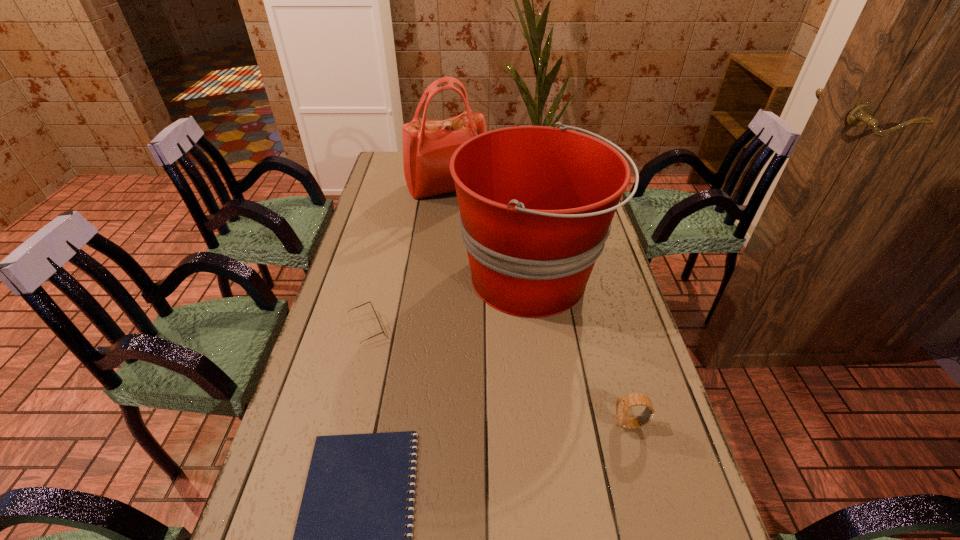
The width and height of the screenshot is (960, 540). In order to click on the farthest object in this screenshot , I will do `click(428, 145)`.

Locate an element on the screen. bucket is located at coordinates (536, 203).

In order to click on watch in this screenshot , I will do `click(623, 404)`.

In order to click on the fourth tallest object in this screenshot , I will do tap(369, 301).

Where is `blank space located on the front-facing side of the handbag`? The width and height of the screenshot is (960, 540). blank space located on the front-facing side of the handbag is located at coordinates (445, 224).

Locate an element on the screen. The image size is (960, 540). vacant region located on the back of the bucket is located at coordinates (520, 191).

Locate an element on the screen. free spot located 0.370m on the face of the third shortest object is located at coordinates (449, 424).

The height and width of the screenshot is (540, 960). Identify the location of vacant region located 0.220m on the face of the third shortest object. (516, 424).

Identify the location of blank space located 0.400m on the face of the third shortest object. The width and height of the screenshot is (960, 540). 436,424.

Locate an element on the screen. blank space located with the lenses facing outward on the spectacles is located at coordinates (509, 328).